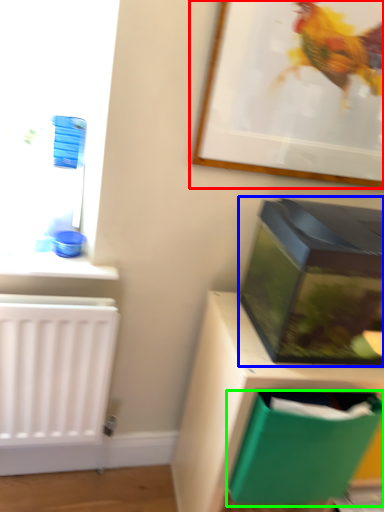
Question: Estimate the real-world distances between objects in this image. Which object is farther from picture frame (highlighted by a red box), box (highlighted by a blue box) or storage box (highlighted by a green box)?

Choices:
 (A) box
 (B) storage box

Answer: (B)